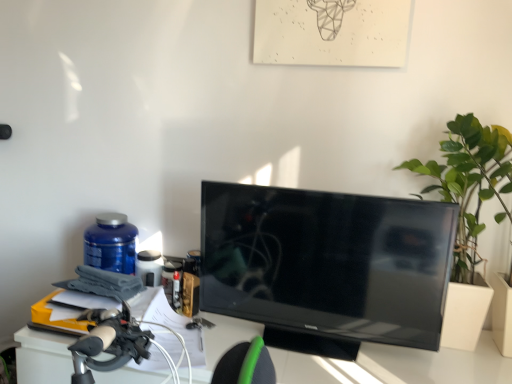
Question: Would you say blue plastic bottle at left contains black glossy tv at center?

Choices:
 (A) yes
 (B) no

Answer: (B)

Question: Does blue plastic bottle at left have a smaller size compared to black glossy tv at center?

Choices:
 (A) no
 (B) yes

Answer: (B)

Question: Considering the relative sizes of blue plastic bottle at left and black glossy tv at center in the image provided, is blue plastic bottle at left shorter than black glossy tv at center?

Choices:
 (A) no
 (B) yes

Answer: (B)

Question: Is blue plastic bottle at left at the right side of black glossy tv at center?

Choices:
 (A) yes
 (B) no

Answer: (B)

Question: Is blue plastic bottle at left positioned in front of black glossy tv at center?

Choices:
 (A) no
 (B) yes

Answer: (A)

Question: In terms of height, does blue plastic bottle at left look taller or shorter compared to green leafy plant at right?

Choices:
 (A) tall
 (B) short

Answer: (B)

Question: From a real-world perspective, is blue plastic bottle at left physically located above or below green leafy plant at right?

Choices:
 (A) above
 (B) below

Answer: (B)

Question: In the image, is blue plastic bottle at left positioned in front of or behind green leafy plant at right?

Choices:
 (A) front
 (B) behind

Answer: (B)

Question: Looking at the image, does blue plastic bottle at left seem bigger or smaller compared to green leafy plant at right?

Choices:
 (A) big
 (B) small

Answer: (B)

Question: Is green leafy plant at right wider or thinner than blue plastic bottle at left?

Choices:
 (A) thin
 (B) wide

Answer: (B)

Question: In terms of size, does green leafy plant at right appear bigger or smaller than blue plastic bottle at left?

Choices:
 (A) big
 (B) small

Answer: (A)

Question: Is green leafy plant at right to the left or to the right of blue plastic bottle at left in the image?

Choices:
 (A) right
 (B) left

Answer: (A)

Question: From a real-world perspective, relative to blue plastic bottle at left, is green leafy plant at right vertically above or below?

Choices:
 (A) below
 (B) above

Answer: (B)

Question: Is point (129, 258) closer or farther from the camera than point (348, 332)?

Choices:
 (A) closer
 (B) farther

Answer: (B)

Question: Considering the positions of blue plastic bottle at left and black glossy tv at center in the image, is blue plastic bottle at left bigger or smaller than black glossy tv at center?

Choices:
 (A) small
 (B) big

Answer: (A)